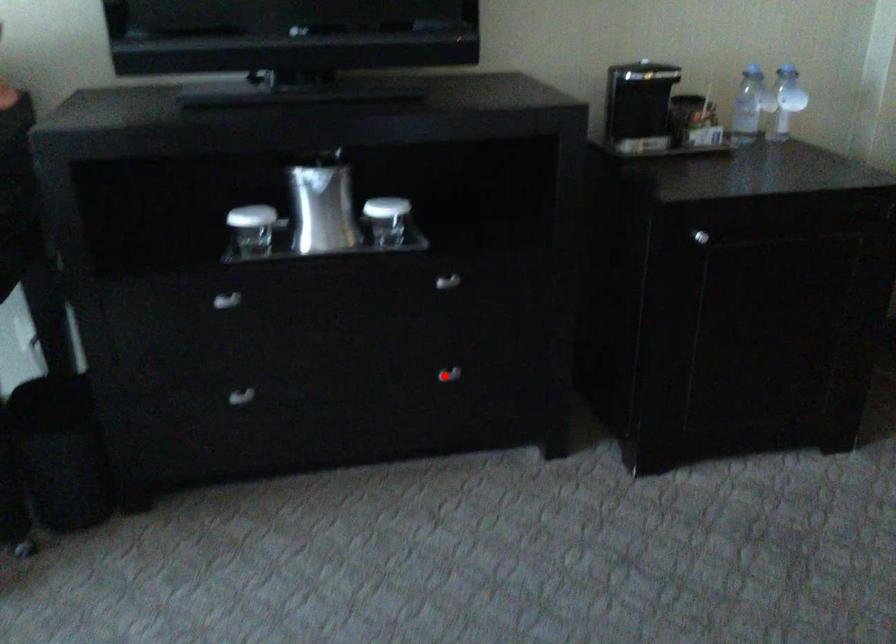
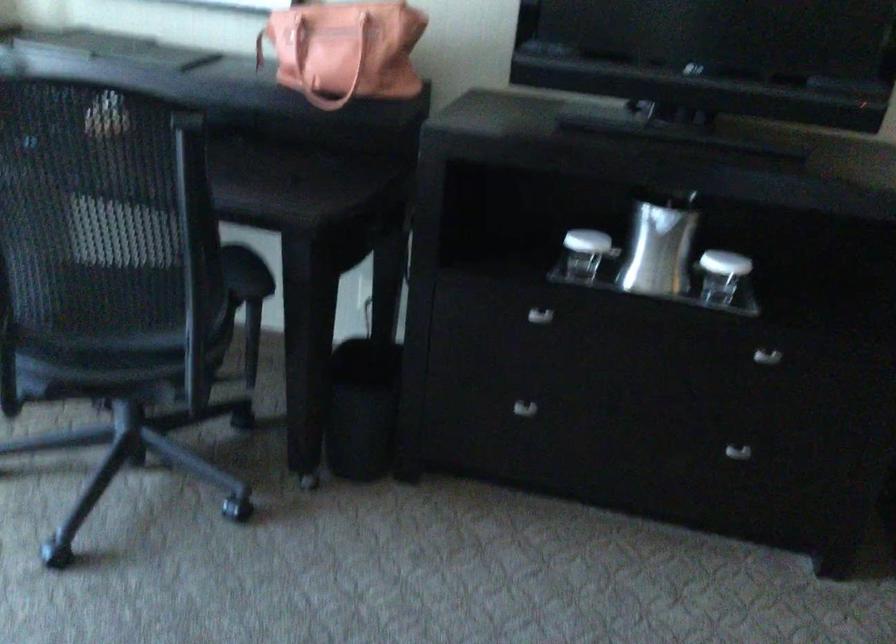
In the second image, find the point that corresponds to the highlighted location in the first image.

(737, 451)